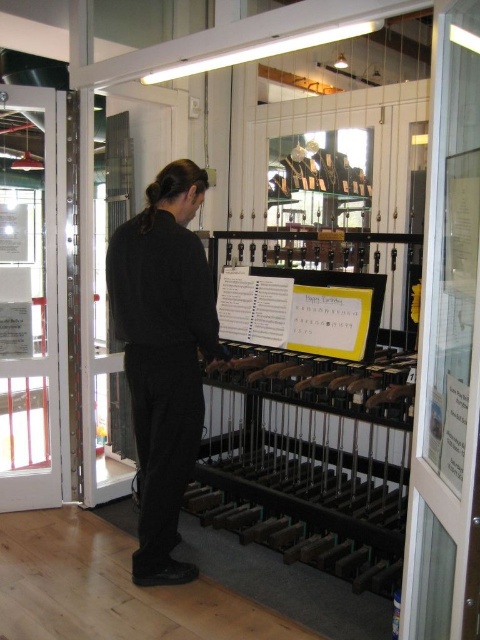
Question: Which point is farther to the camera?

Choices:
 (A) (199, 392)
 (B) (410, 480)
 (C) (220, 326)
 (D) (46, 400)

Answer: (D)

Question: Among these objects, which one is nearest to the camera?

Choices:
 (A) black matte pants at center
 (B) clear glass door at left

Answer: (A)

Question: Which object is farther from the camera taking this photo?

Choices:
 (A) yellow paper at center
 (B) black matte pants at center

Answer: (A)

Question: Does black matte pants at center have a larger size compared to yellow paper at center?

Choices:
 (A) yes
 (B) no

Answer: (A)

Question: Is clear glass door at left further to camera compared to yellow paper at center?

Choices:
 (A) no
 (B) yes

Answer: (B)

Question: Is transparent glass door at right above yellow paper at center?

Choices:
 (A) yes
 (B) no

Answer: (B)